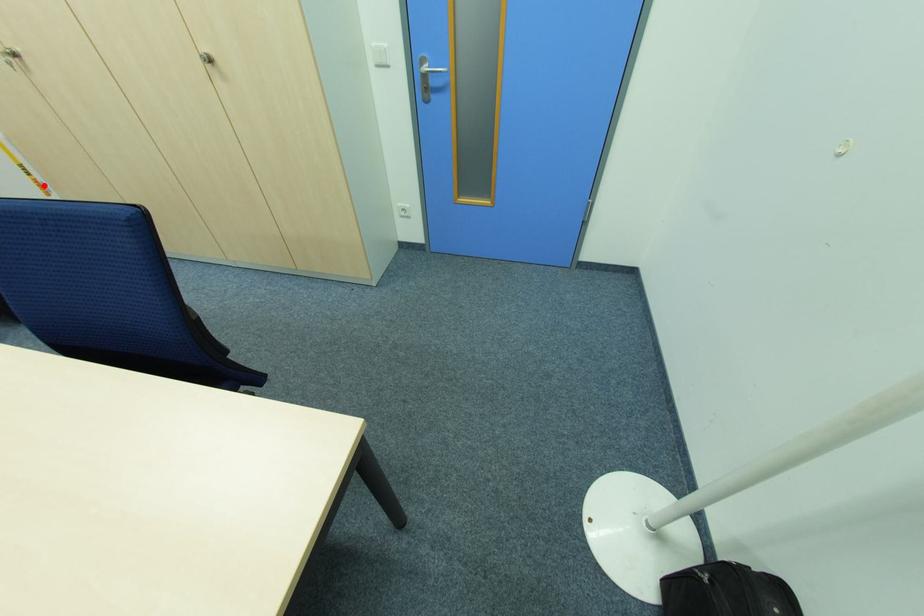
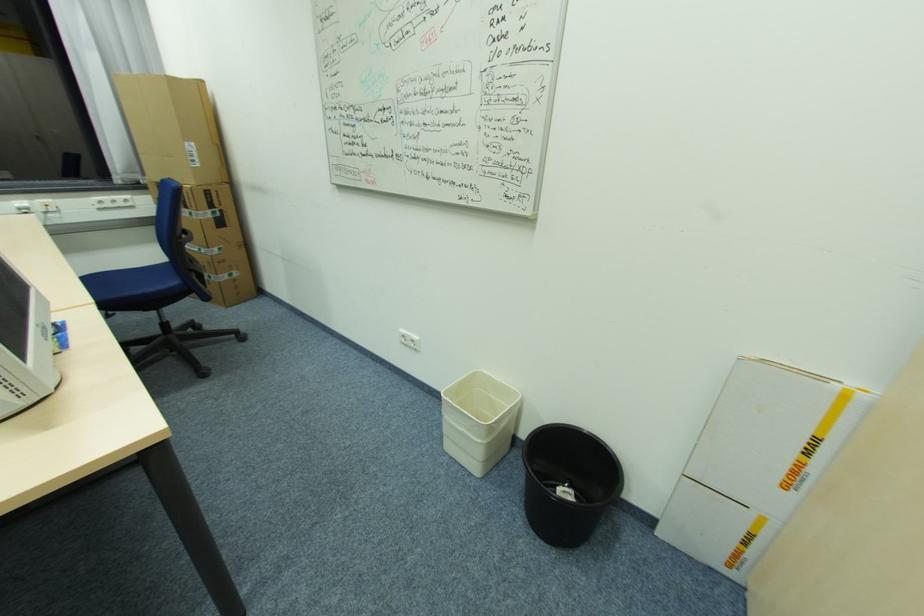
Question: I am providing you with two images of the same scene from different viewpoints. Image1 has a red point marked. In image2, the corresponding 3D location appears at what relative position? Reply with the corresponding letter.

Choices:
 (A) Closer
 (B) Farther

Answer: (A)